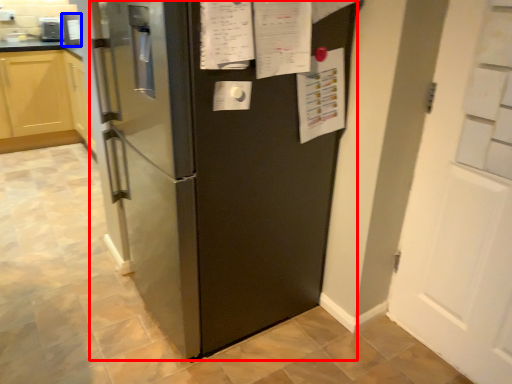
Question: Among these objects, which one is farthest to the camera, refrigerator (highlighted by a red box) or appliance (highlighted by a blue box)?

Choices:
 (A) refrigerator
 (B) appliance

Answer: (B)